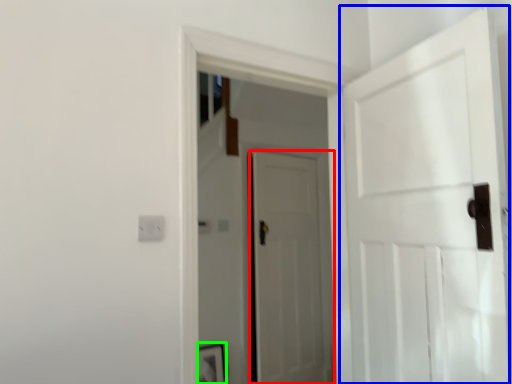
Question: Based on their relative distances, which object is nearer to door (highlighted by a red box)? Choose from door (highlighted by a blue box) and picture frame (highlighted by a green box).

Choices:
 (A) door
 (B) picture frame

Answer: (B)